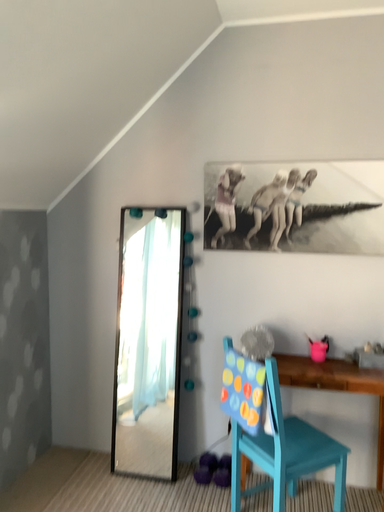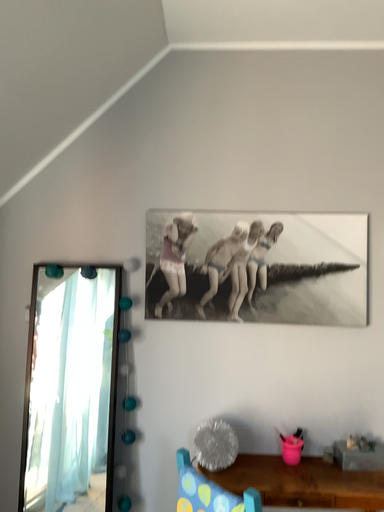
Question: How did the camera likely rotate when shooting the video?

Choices:
 (A) rotated right
 (B) rotated left

Answer: (A)